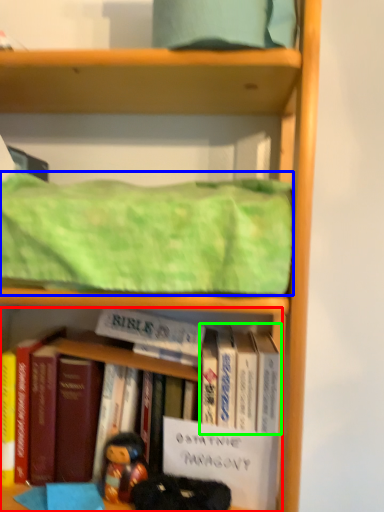
Question: Which object is positioned closest to book (highlighted by a red box)? Select from blanket (highlighted by a blue box) and book (highlighted by a green box).

Choices:
 (A) blanket
 (B) book

Answer: (B)